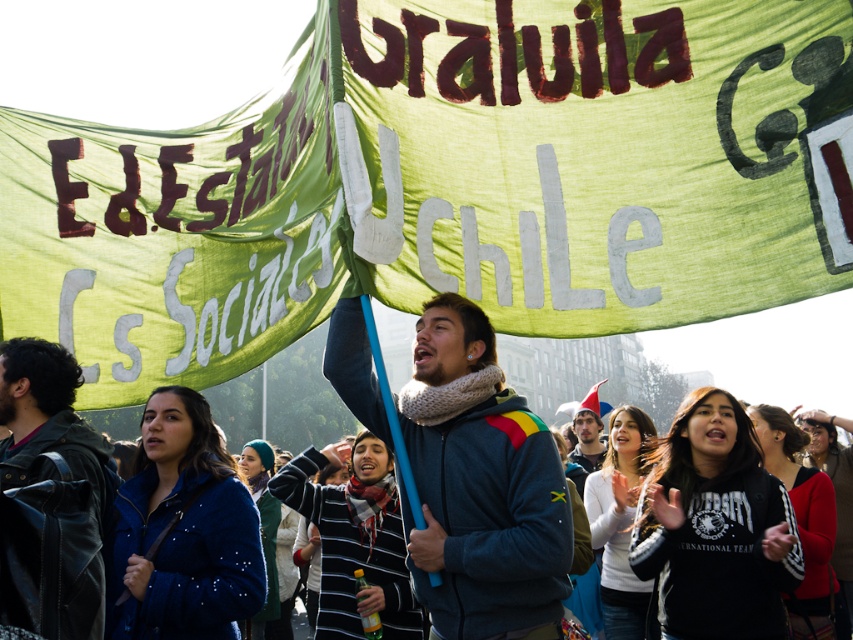
Is dark brown leather jacket at lower left below dark blue sweater at center?

Actually, dark brown leather jacket at lower left is above dark blue sweater at center.

Measure the distance from dark brown leather jacket at lower left to dark blue sweater at center.

They are 34.39 meters apart.

Is point (59, 490) positioned after point (595, 460)?

No, (59, 490) is in front of (595, 460).

Where is `dark brown leather jacket at lower left`? This screenshot has width=853, height=640. dark brown leather jacket at lower left is located at coordinates (54, 483).

Who is shorter, dark gray fleece jacket at center or dark blue sweater at center?

dark blue sweater at center

Who is taller, dark gray fleece jacket at center or dark blue sweater at center?

dark gray fleece jacket at center

The width and height of the screenshot is (853, 640). What do you see at coordinates (483, 492) in the screenshot?
I see `dark gray fleece jacket at center` at bounding box center [483, 492].

Locate an element on the screen. Image resolution: width=853 pixels, height=640 pixels. dark gray fleece jacket at center is located at coordinates (483, 492).

Does green fabric banner at upper center come in front of dark blue sweater at center?

Yes, green fabric banner at upper center is closer to the viewer.

What do you see at coordinates (445, 182) in the screenshot? I see `green fabric banner at upper center` at bounding box center [445, 182].

Identify the location of green fabric banner at upper center. The height and width of the screenshot is (640, 853). (445, 182).